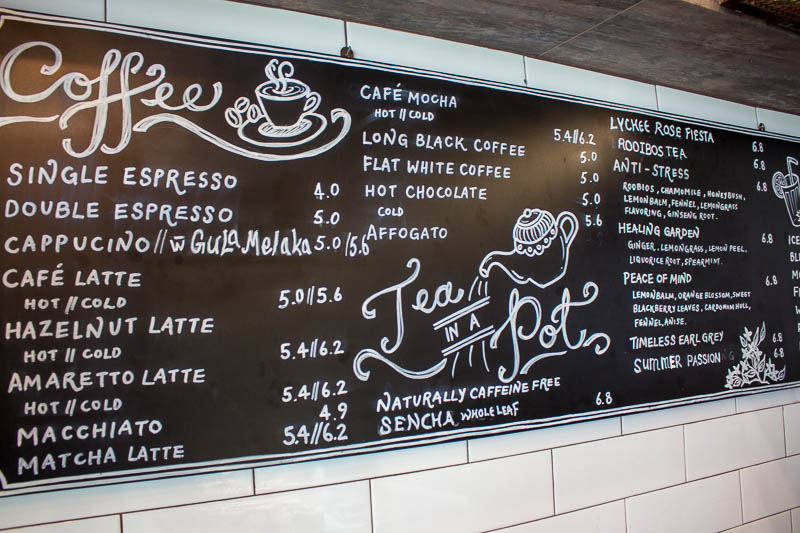
Identify the location of wall. This screenshot has width=800, height=533. (685, 467).